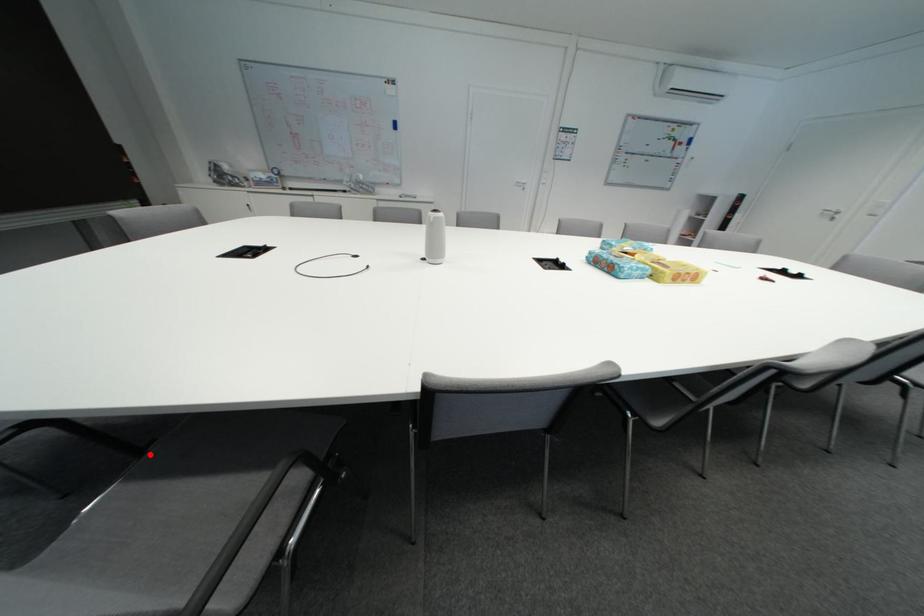
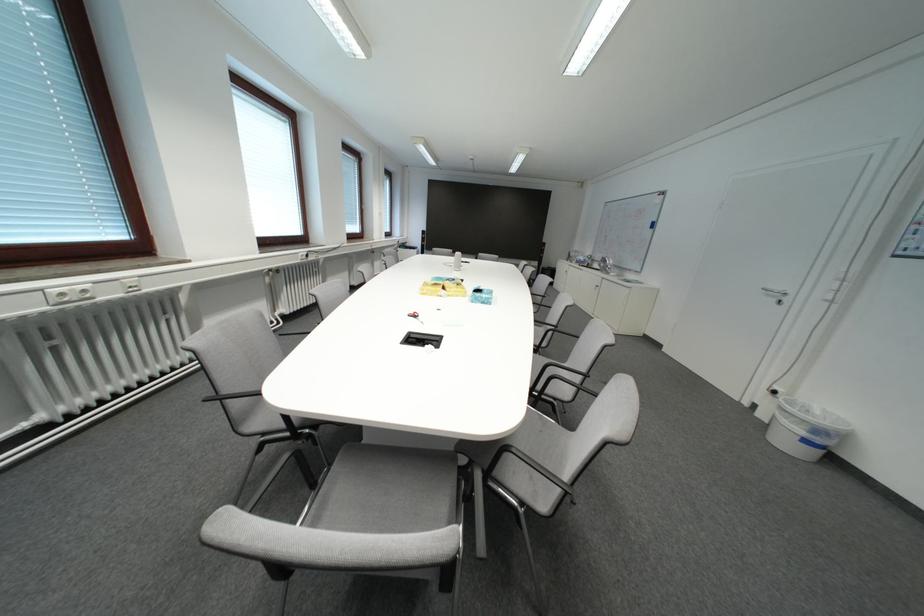
Question: I am providing you with two images of the same scene from different viewpoints. A red point is marked on the first image. At the location where the point appears in image 1, is it still visible in image 2?

Choices:
 (A) Yes
 (B) No

Answer: (B)